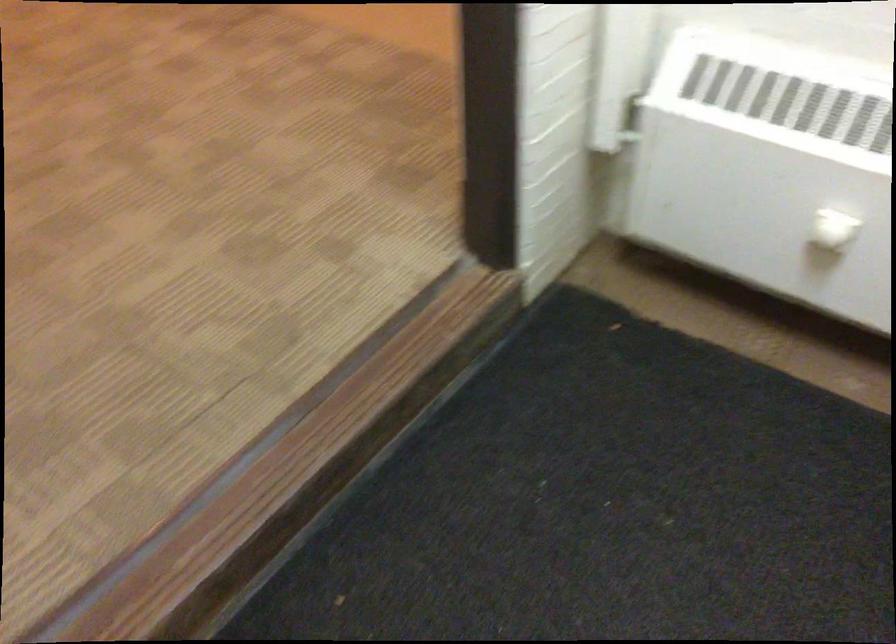
Describe the element at coordinates (831, 236) in the screenshot. I see `a white radiator knob` at that location.